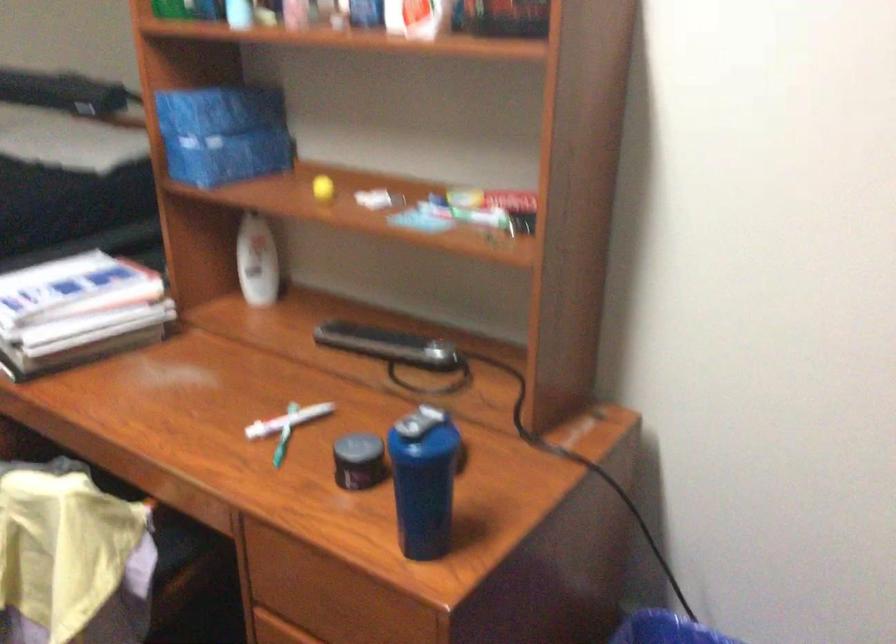
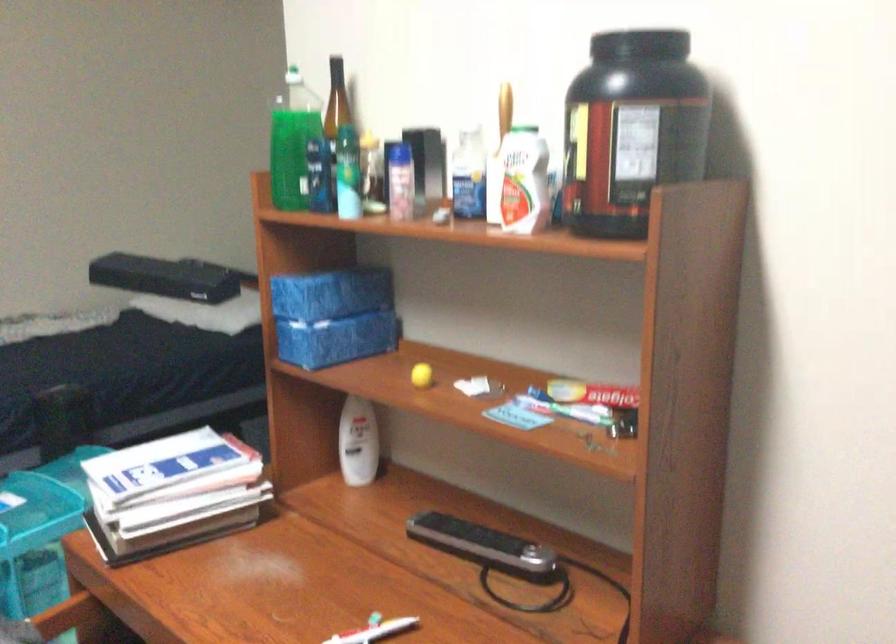
Question: The images are taken continuously from a first-person perspective. In which direction is your viewpoint rotating?

Choices:
 (A) Left
 (B) Right
 (C) Up
 (D) Down

Answer: (C)